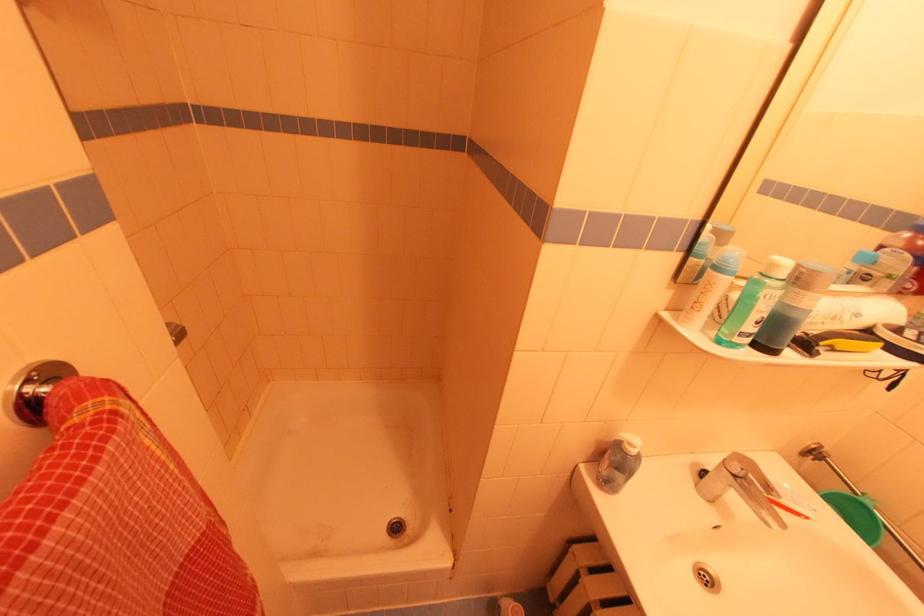
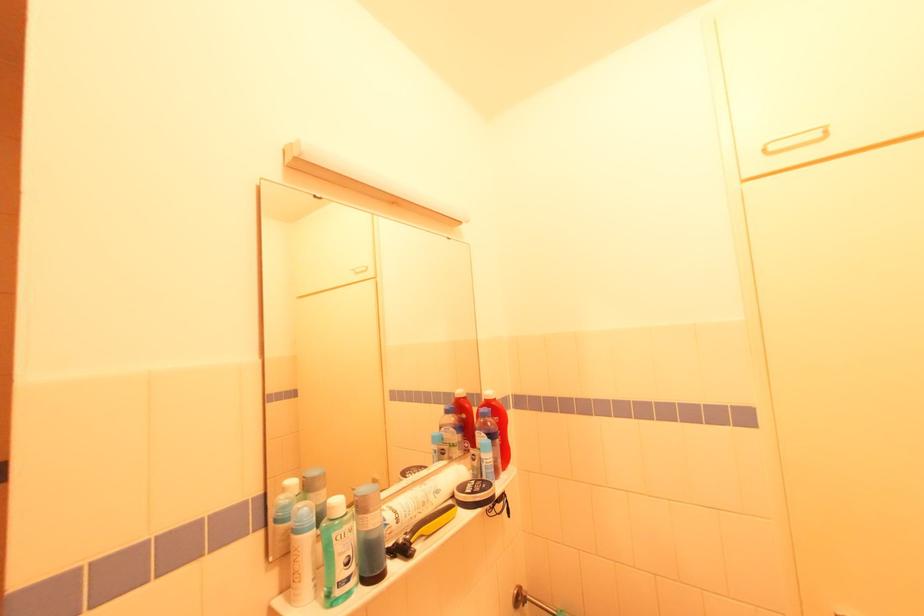
Find the pixel in the second image that matches (811,294) in the first image.

(371, 517)